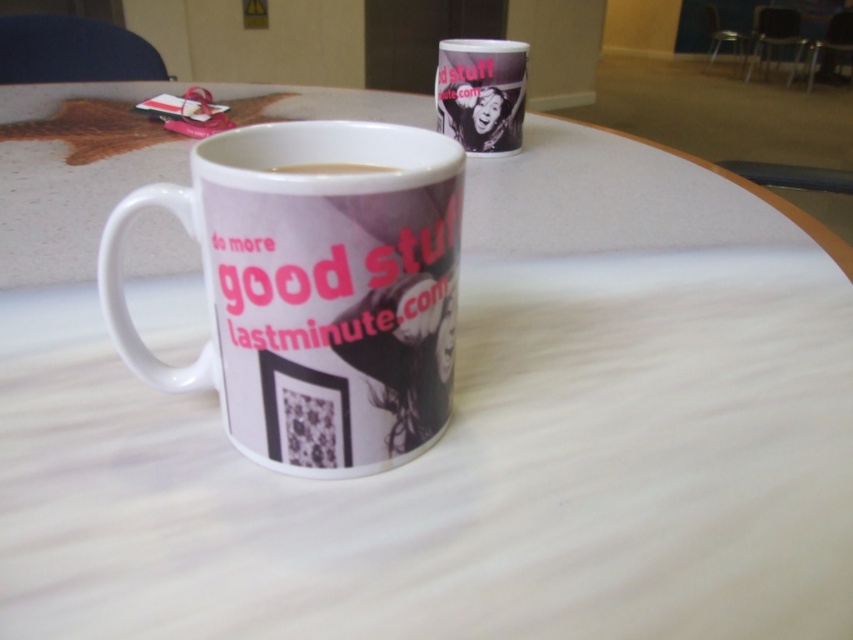
Question: Estimate the real-world distances between objects in this image. Which object is farther from the white ceramic mug at center?

Choices:
 (A) white glossy coffee cup at center
 (B) white paper cup at upper center

Answer: (B)

Question: Which of the following is the farthest from the observer?

Choices:
 (A) (515, 58)
 (B) (138, 198)
 (C) (386, 168)

Answer: (A)

Question: Considering the relative positions of white ceramic mug at center and white paper cup at upper center in the image provided, where is white ceramic mug at center located with respect to white paper cup at upper center?

Choices:
 (A) above
 (B) below

Answer: (B)

Question: Which object appears farthest from the camera in this image?

Choices:
 (A) white glossy coffee cup at center
 (B) white ceramic mug at center
 (C) white paper cup at upper center

Answer: (C)

Question: Is white paper cup at upper center below white glossy coffee cup at center?

Choices:
 (A) yes
 (B) no

Answer: (B)

Question: Can you confirm if white ceramic mug at center is thinner than white glossy coffee cup at center?

Choices:
 (A) no
 (B) yes

Answer: (A)